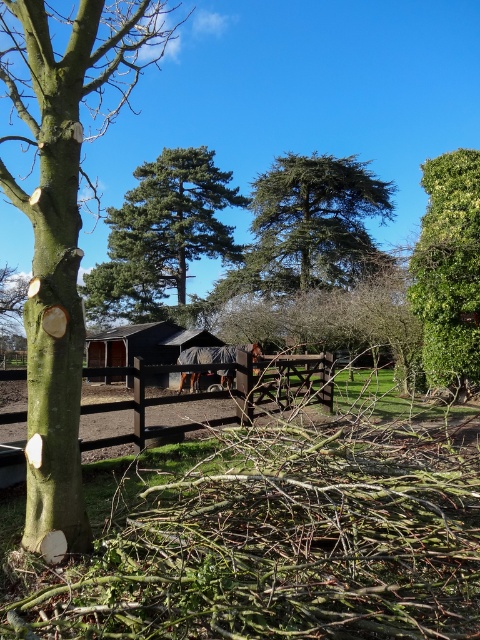
What are the coordinates of the green textured pine tree at center?

The green textured pine tree at center is located at coordinates point [162,236].

You are planning to build a new shed in this area. Considering the green textured pine tree at center and the dark gray tarpaulin hut at center, which one would cast a longer shadow at noon?

The green textured pine tree at center is much taller than the dark gray tarpaulin hut at center, so it would cast a longer shadow at noon.